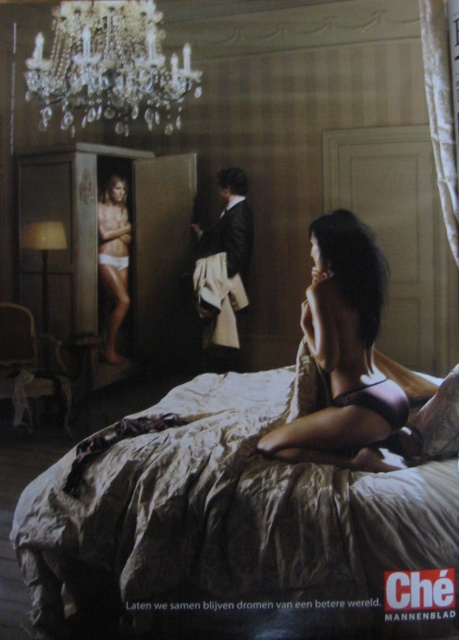
You are a fashion designer examining the image of the opulent room. You need to place a new accessory exactly at the center of the room. The current satin black lingerie at center is at coordinates point 0.553, 0.749. Is the lingerie at center positioned at the exact center of the room?

The satin black lingerie at center is located at point [343,353], which is not the exact center of the room since the exact center would be at point [229,320]. Therefore, the lingerie is slightly offset from the true center.

You are a photographer setting up a shoot in this room. You need to position a spotlight to the left of the crystal glass chandelier at upper center. Will the spotlight interfere with the visibility of the satin black lingerie at center?

The satin black lingerie at center is to the right of the crystal glass chandelier at upper center. Placing the spotlight to the left of the chandelier would position it away from the lingerie, so it should not interfere with its visibility.

You are standing in the opulent room with the vintage chandelier. There is a specific point marked at coordinates [110,67]. What object is this point located on?

The point at coordinates [110,67] is located on the crystal glass chandelier at upper center.